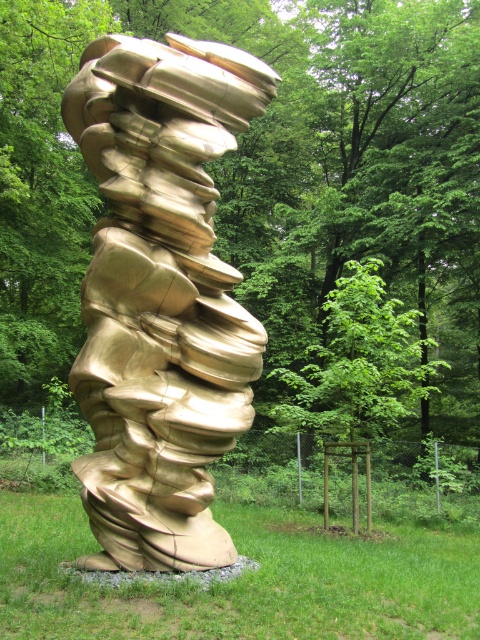
Can you confirm if gold metallic sculpture at center is positioned to the right of green grass at lower center?

In fact, gold metallic sculpture at center is to the left of green grass at lower center.

Is gold metallic sculpture at center wider than green grass at lower center?

No.

Does point (179, 472) come behind point (159, 600)?

That is True.

At what (x,y) coordinates should I click in order to perform the action: click on gold metallic sculpture at center. Please return your answer as a coordinate pair (x, y). Looking at the image, I should click on (160, 296).

Between green leafy tree at center and gold metallic sculpture at center, which one is positioned lower?

Positioned lower is gold metallic sculpture at center.

Is point (314, 115) more distant than point (104, 227)?

Yes, point (314, 115) is farther from viewer.

Is point (372, 36) positioned in front of point (188, 337)?

No, (372, 36) is behind (188, 337).

This screenshot has height=640, width=480. I want to click on green leafy tree at center, so click(x=269, y=180).

Does green leafy tree at center appear over green grass at lower center?

Correct, green leafy tree at center is located above green grass at lower center.

Between green leafy tree at center and green grass at lower center, which one is positioned lower?

green grass at lower center is below.

Is point (442, 257) more distant than point (260, 595)?

That is True.

The height and width of the screenshot is (640, 480). I want to click on green leafy tree at center, so click(269, 180).